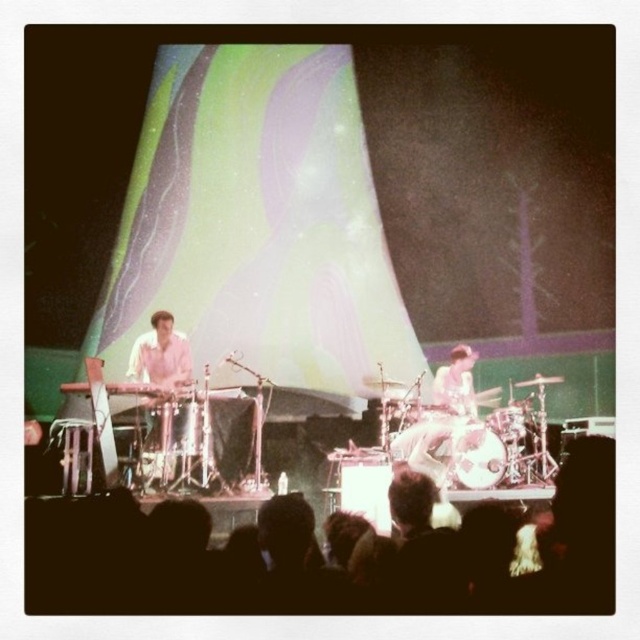
Question: Is white wood drum at center closer to the viewer compared to smooth white drum at center?

Choices:
 (A) no
 (B) yes

Answer: (B)

Question: Which object appears closest to the camera in this image?

Choices:
 (A) smooth white drum at center
 (B) white wood drum at center

Answer: (B)

Question: Which object is farther from the camera taking this photo?

Choices:
 (A) white wood drum at center
 (B) smooth white drum at center
 (C) brushed metal drum at center

Answer: (B)

Question: Considering the real-world distances, which object is closest to the white wood drum at center?

Choices:
 (A) brushed metal drum at center
 (B) smooth white drum at center

Answer: (B)

Question: Observing the image, what is the correct spatial positioning of brushed metal drum at center in reference to smooth white drum at center?

Choices:
 (A) right
 (B) left

Answer: (B)

Question: Does brushed metal drum at center appear on the left side of smooth white drum at center?

Choices:
 (A) no
 (B) yes

Answer: (B)